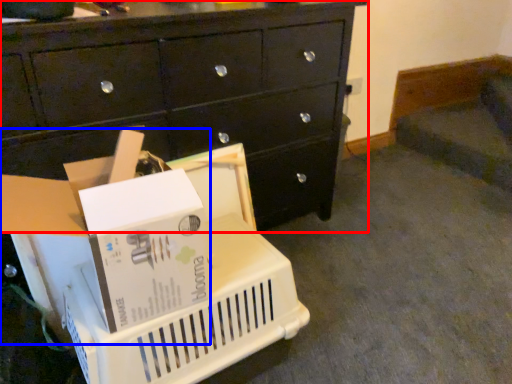
Question: Which object is closer to the camera taking this photo, chest of drawers (highlighted by a red box) or storage box (highlighted by a blue box)?

Choices:
 (A) chest of drawers
 (B) storage box

Answer: (B)